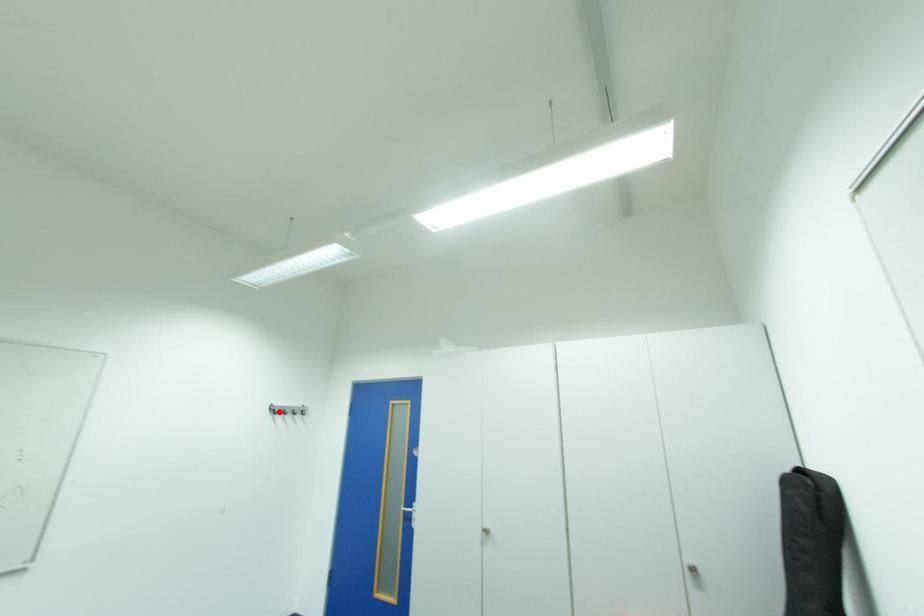
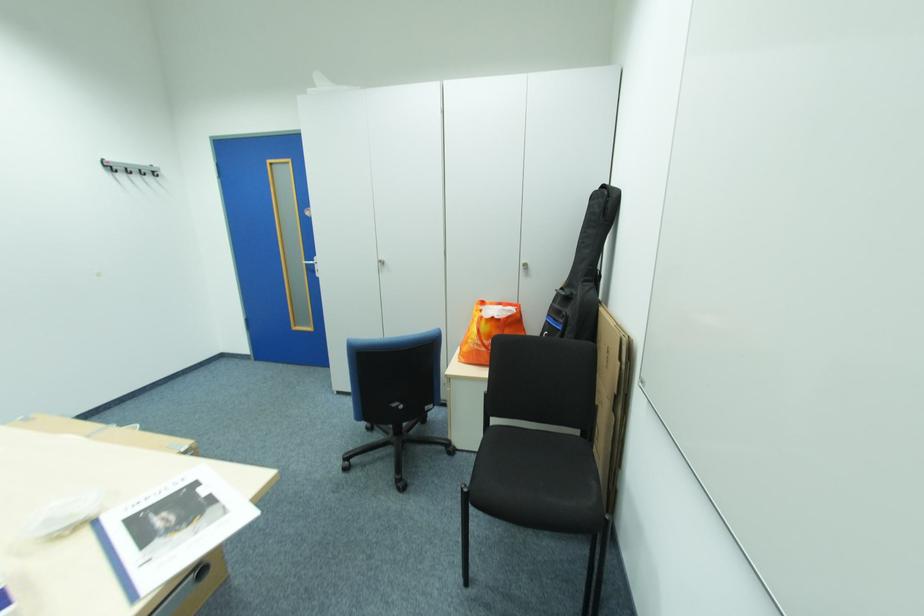
In the second image, find the point that corresponds to the highlighted location in the first image.

(114, 171)